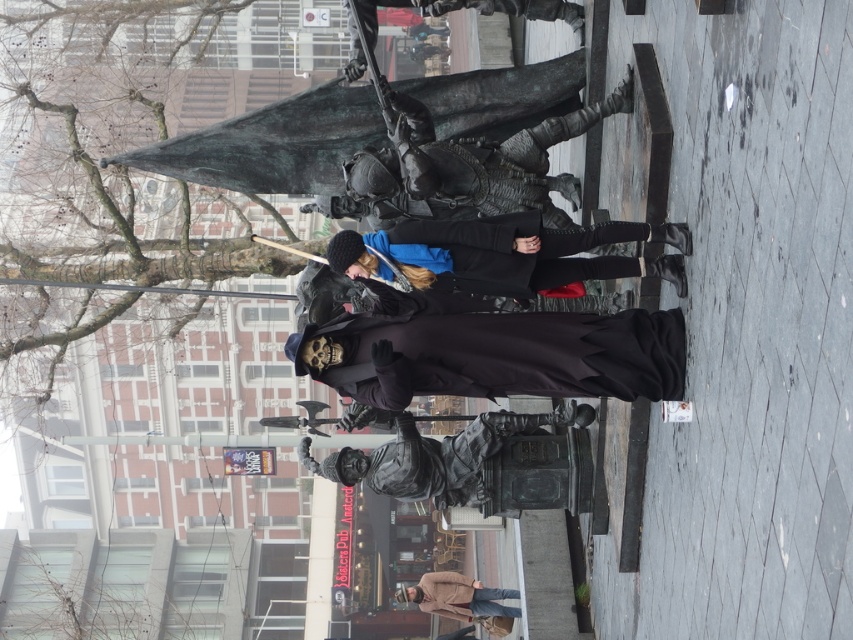
Question: Which is farther from the bronze armor at center?

Choices:
 (A) black matte coat at center
 (B) gray concrete pavement at lower right
 (C) beige wool coat at lower center

Answer: (C)

Question: Which object is positioned farthest from the bronze armor at center?

Choices:
 (A) beige wool coat at lower center
 (B) gray concrete pavement at lower right
 (C) matte black skull mask at center

Answer: (A)

Question: Does matte black skull mask at center come behind bronze statue at center?

Choices:
 (A) no
 (B) yes

Answer: (A)

Question: Which point is closer to the camera taking this photo?

Choices:
 (A) (389, 490)
 (B) (547, 554)

Answer: (A)

Question: Is bronze armor at center bigger than shiny black armor at upper center?

Choices:
 (A) yes
 (B) no

Answer: (A)

Question: Considering the relative positions of bronze statue at center and gray concrete pavement at lower right in the image provided, where is bronze statue at center located with respect to gray concrete pavement at lower right?

Choices:
 (A) below
 (B) above

Answer: (B)